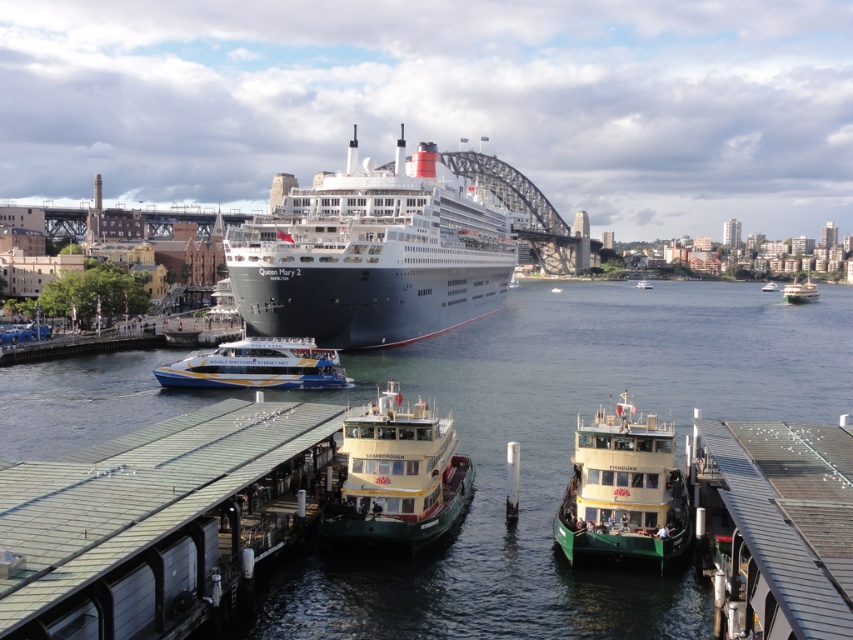
Can you confirm if yellow-green plastic boat at right is positioned above white plastic boat at center?

Incorrect, yellow-green plastic boat at right is not positioned above white plastic boat at center.

Where is `yellow-green plastic boat at right`? This screenshot has height=640, width=853. yellow-green plastic boat at right is located at coordinates (799, 291).

The height and width of the screenshot is (640, 853). In order to click on yellow-green plastic boat at right in this screenshot , I will do `click(799, 291)`.

Can you confirm if dark gray metallic ship at center is shorter than white plastic boat at center?

In fact, dark gray metallic ship at center may be taller than white plastic boat at center.

Between dark gray metallic ship at center and white plastic boat at center, which one is positioned higher?

dark gray metallic ship at center

Image resolution: width=853 pixels, height=640 pixels. What do you see at coordinates (372, 256) in the screenshot?
I see `dark gray metallic ship at center` at bounding box center [372, 256].

Find the location of a particular element. The width and height of the screenshot is (853, 640). dark gray metallic ship at center is located at coordinates (372, 256).

Who is shorter, green corrugated metal dock at lower center or white plastic boat at center?

Standing shorter between the two is green corrugated metal dock at lower center.

The image size is (853, 640). What do you see at coordinates (154, 518) in the screenshot?
I see `green corrugated metal dock at lower center` at bounding box center [154, 518].

The width and height of the screenshot is (853, 640). I want to click on green corrugated metal dock at lower center, so click(x=154, y=518).